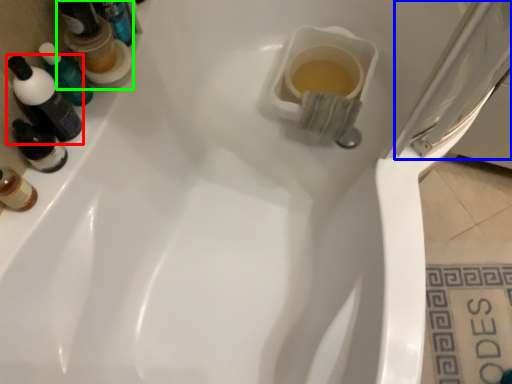
Question: Estimate the real-world distances between objects in this image. Which object is farther from mouthwash (highlighted by a red box), screen door (highlighted by a blue box) or mouthwash (highlighted by a green box)?

Choices:
 (A) screen door
 (B) mouthwash

Answer: (A)